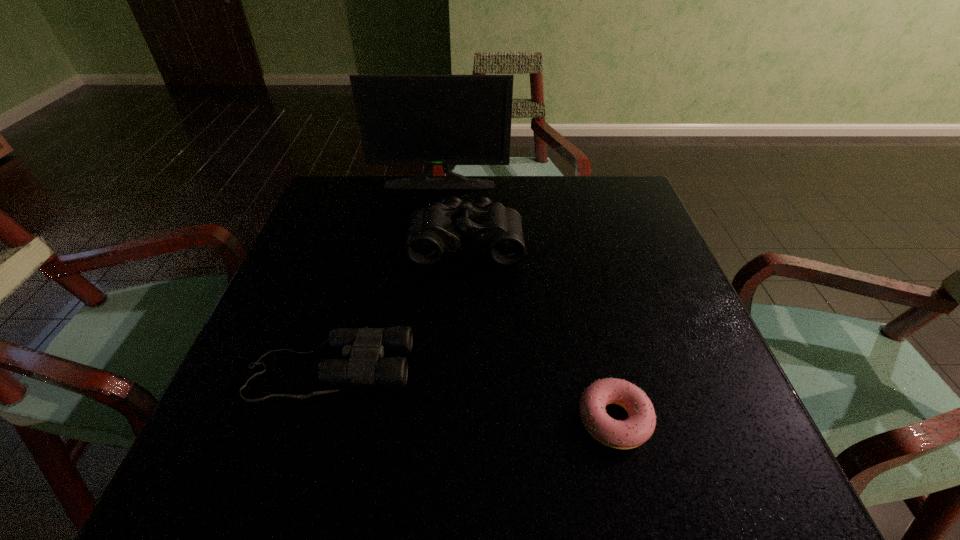
Locate an element on the screen. Image resolution: width=960 pixels, height=540 pixels. blank area in the image that satisfies the following two spatial constraints: 1. at the eyepieces of the farther binoculars; 2. at the eyepiece of the shorter binoculars is located at coordinates (462, 369).

Locate an element on the screen. The width and height of the screenshot is (960, 540). vacant area that satisfies the following two spatial constraints: 1. at the eyepieces of the doughnut; 2. on the left side of the taller binoculars is located at coordinates (460, 420).

The height and width of the screenshot is (540, 960). I want to click on free space that satisfies the following two spatial constraints: 1. on the front-facing side of the rightmost object; 2. on the right side of the monitor, so click(x=409, y=420).

Image resolution: width=960 pixels, height=540 pixels. What are the coordinates of `vacant space that satisfies the following two spatial constraints: 1. on the front-facing side of the doughnut; 2. on the left side of the farthest object` in the screenshot? It's located at (409, 420).

This screenshot has height=540, width=960. What are the coordinates of `free space in the image that satisfies the following two spatial constraints: 1. on the front-facing side of the farthest object; 2. on the right side of the shortest object` in the screenshot? It's located at (409, 420).

Identify the location of free spot that satisfies the following two spatial constraints: 1. at the eyepiece of the rightmost object; 2. on the left side of the shorter binoculars. (315, 420).

Locate an element on the screen. free region that satisfies the following two spatial constraints: 1. at the eyepieces of the third nearest object; 2. at the eyepiece of the shorter binoculars is located at coordinates (462, 369).

Where is `vacant point that satisfies the following two spatial constraints: 1. on the front-facing side of the tallest object; 2. at the eyepiece of the shorter binoculars`? The width and height of the screenshot is (960, 540). vacant point that satisfies the following two spatial constraints: 1. on the front-facing side of the tallest object; 2. at the eyepiece of the shorter binoculars is located at coordinates (416, 369).